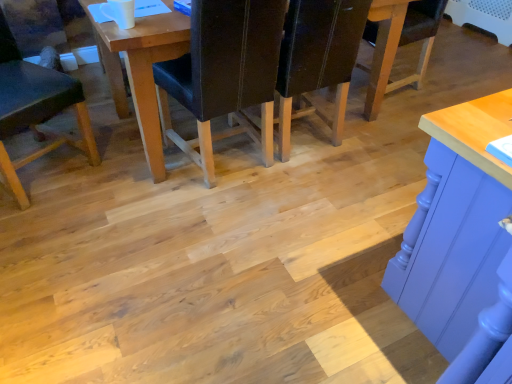
Locate an element on the screen. vacant area to the right of dark brown leather chair at center, which is the first chair from right to left is located at coordinates (384, 141).